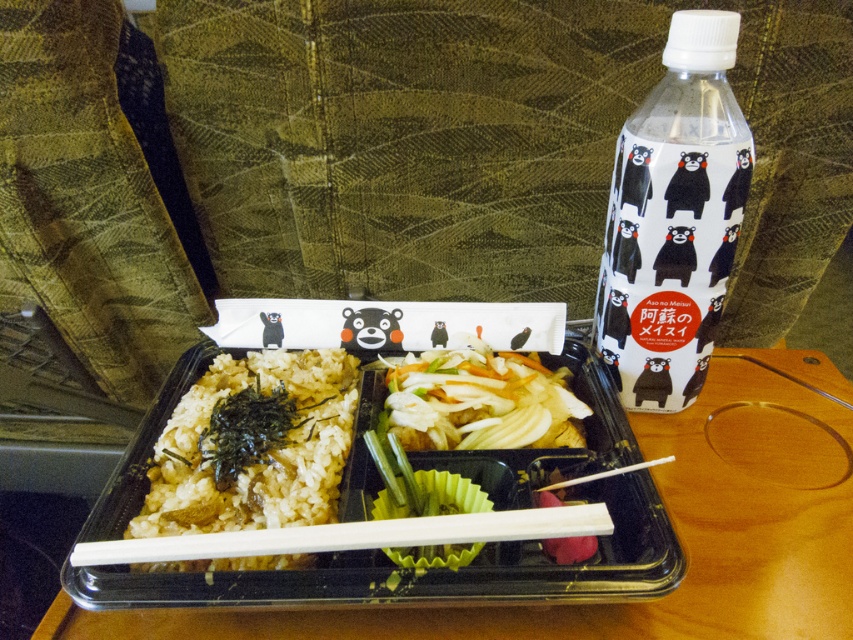
Question: Which of these objects is positioned closest to the white rice with seaweed at lower left?

Choices:
 (A) white plastic bottle at upper right
 (B) white glossy vegetables at center

Answer: (B)

Question: Which point appears closest to the camera in this image?

Choices:
 (A) (662, 252)
 (B) (671, 458)

Answer: (A)

Question: Does white glossy vegetables at center have a lesser width compared to wooden chopsticks at center?

Choices:
 (A) no
 (B) yes

Answer: (B)

Question: Which object appears closest to the camera in this image?

Choices:
 (A) white glossy vegetables at center
 (B) white rice with seaweed at lower left

Answer: (B)

Question: Is white plastic bottle at upper right to the left of white rice with seaweed at lower left from the viewer's perspective?

Choices:
 (A) yes
 (B) no

Answer: (B)

Question: Is white rice with seaweed at lower left closer to camera compared to white glossy vegetables at center?

Choices:
 (A) no
 (B) yes

Answer: (B)